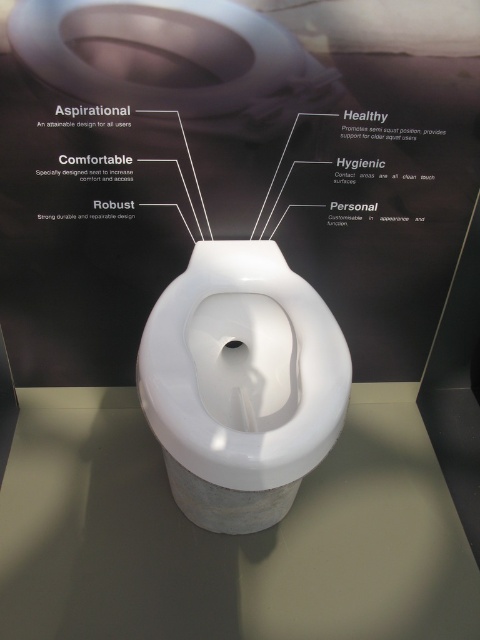
You are designing a bathroom layout and need to ensure there is enough vertical space between the white glossy toilet at center and the white plastic toilet at center. According to the image, which toilet requires more vertical space?

The white glossy toilet at center requires more vertical space because it is taller than the white plastic toilet at center.

You are designing a bathroom layout and need to ensure proper spacing between the white glossy toilet bowl at center and the matte white toilet lid at upper center. Given their sizes, which one requires more horizontal space to accommodate its dimensions?

The white glossy toilet bowl at center requires more horizontal space because it is bigger than the matte white toilet lid at upper center.